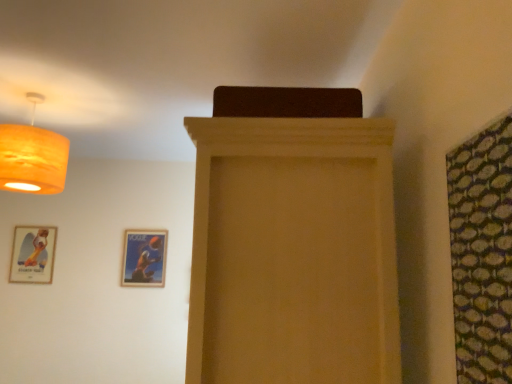
Question: Looking at their shapes, would you say green textured fabric at right is wider or thinner than matte wood cabinet at center?

Choices:
 (A) wide
 (B) thin

Answer: (B)

Question: Does point (476, 317) appear closer or farther from the camera than point (284, 195)?

Choices:
 (A) farther
 (B) closer

Answer: (B)

Question: Considering the real-world distances, which object is closest to the matte wood cabinet at center?

Choices:
 (A) matte gold picture frame at lower left, which is counted as the second picture frame, starting from the right
 (B) green textured fabric at right
 (C) matte orange lampshade at upper left
 (D) wooden glossy picture frame at lower center, marked as the 1th picture frame in a right-to-left arrangement

Answer: (B)

Question: Which object is the farthest from the wooden glossy picture frame at lower center, marked as the 1th picture frame in a right-to-left arrangement?

Choices:
 (A) matte gold picture frame at lower left, which is counted as the second picture frame, starting from the right
 (B) matte orange lampshade at upper left
 (C) matte wood cabinet at center
 (D) green textured fabric at right

Answer: (D)